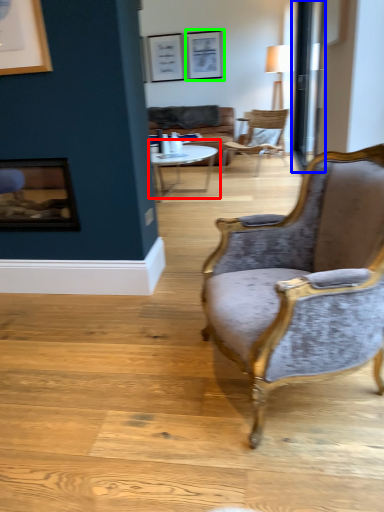
Question: Which is farther away from coffee table (highlighted by a red box)? glass door (highlighted by a blue box) or picture frame (highlighted by a green box)?

Choices:
 (A) glass door
 (B) picture frame

Answer: (B)